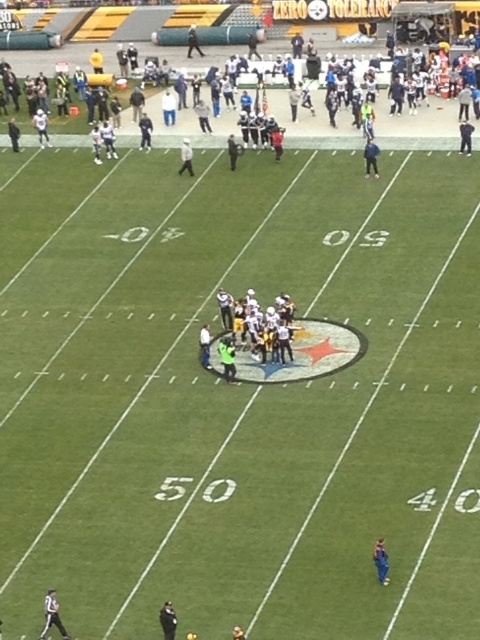
Question: Does blue fabric person at lower right appear under dark blue uniform at center?

Choices:
 (A) no
 (B) yes

Answer: (B)

Question: Considering the relative positions of black fabric person at lower left and white matte helmet at center in the image provided, where is black fabric person at lower left located with respect to white matte helmet at center?

Choices:
 (A) below
 (B) above

Answer: (A)

Question: Which object appears farthest from the camera in this image?

Choices:
 (A) golden helmet at center
 (B) white uniformed official at lower left
 (C) blue fabric person at lower right

Answer: (C)

Question: Does blue fabric person at lower right appear over dark blue uniform at center?

Choices:
 (A) yes
 (B) no

Answer: (B)

Question: Estimate the real-world distances between objects in this image. Which object is farther from the blue fabric person at lower right?

Choices:
 (A) white matte helmet at center
 (B) blue fabric jacket at upper right

Answer: (A)

Question: Which point is farther to the camera?

Choices:
 (A) blue fabric jacket at upper right
 (B) golden helmet at center
 (C) dark blue uniform at center
 (D) white uniformed official at lower left

Answer: (C)